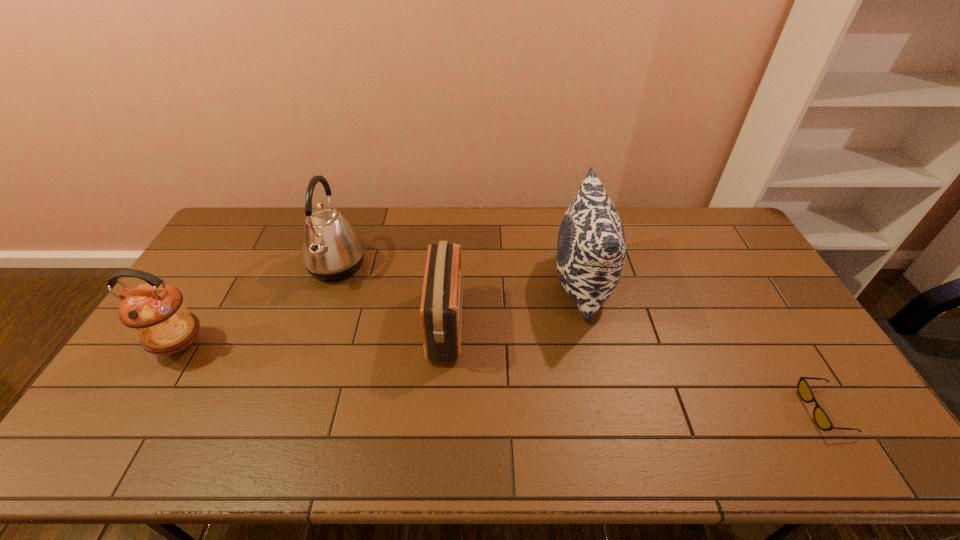
Where is `the fourth object from right to left`? Image resolution: width=960 pixels, height=540 pixels. the fourth object from right to left is located at coordinates (331, 249).

You are a GUI agent. You are given a task and a screenshot of the screen. Output one action in this format:
    pyautogui.click(x=<x>, y=<y>)
    Task: Click on the cushion
    The width and height of the screenshot is (960, 540).
    Given the screenshot: What is the action you would take?
    pyautogui.click(x=591, y=250)

What are the coordinates of `oil lamp` in the screenshot? It's located at (155, 310).

This screenshot has height=540, width=960. I want to click on the third object from left to right, so click(x=441, y=303).

You are a GUI agent. You are given a task and a screenshot of the screen. Output one action in this format:
    pyautogui.click(x=<x>, y=<y>)
    Task: Click on the radio receiver
    Image resolution: width=960 pixels, height=540 pixels.
    Given the screenshot: What is the action you would take?
    pyautogui.click(x=441, y=303)

Where is `the shortest object`? the shortest object is located at coordinates (822, 420).

This screenshot has width=960, height=540. Identify the location of sunglasses. (822, 420).

What are the coordinates of `vacant space located 0.270m from the spout of the kettle` in the screenshot? It's located at (445, 266).

The height and width of the screenshot is (540, 960). I want to click on vacant space located 0.330m on the front surface of the second object from right to left, so click(x=452, y=284).

At what (x,y) coordinates should I click in order to perform the action: click on vacant space located 0.080m on the front surface of the second object from right to left. Please return your answer as a coordinate pair (x, y). Looking at the image, I should click on (528, 284).